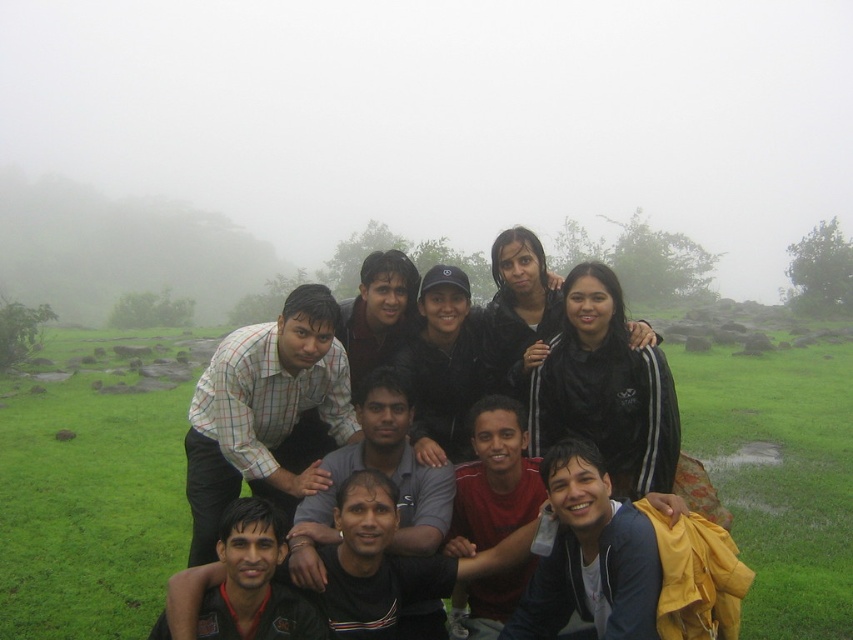
Question: Which of these objects is positioned farthest from the green grass at lower center?

Choices:
 (A) foggy misty mountain at upper left
 (B) white checkered shirt at center

Answer: (A)

Question: From the image, what is the correct spatial relationship of green grass at lower center in relation to foggy misty mountain at upper left?

Choices:
 (A) above
 (B) below

Answer: (B)

Question: Is green grass at lower center above foggy misty mountain at upper left?

Choices:
 (A) yes
 (B) no

Answer: (B)

Question: Where is green grass at lower center located in relation to white checkered shirt at center in the image?

Choices:
 (A) left
 (B) right

Answer: (B)

Question: Which point is farther from the camera taking this photo?

Choices:
 (A) (61, 205)
 (B) (820, 570)

Answer: (A)

Question: Based on their relative distances, which object is farther from the white checkered shirt at center?

Choices:
 (A) green grass at lower center
 (B) foggy misty mountain at upper left

Answer: (B)